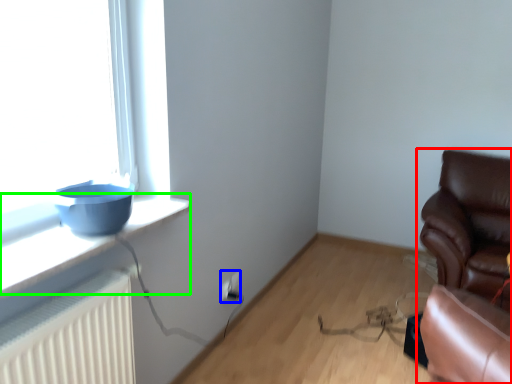
Question: Based on their relative distances, which object is nearer to chair (highlighted by a red box)? Choose from electric outlet (highlighted by a blue box) and window sill (highlighted by a green box).

Choices:
 (A) electric outlet
 (B) window sill

Answer: (A)